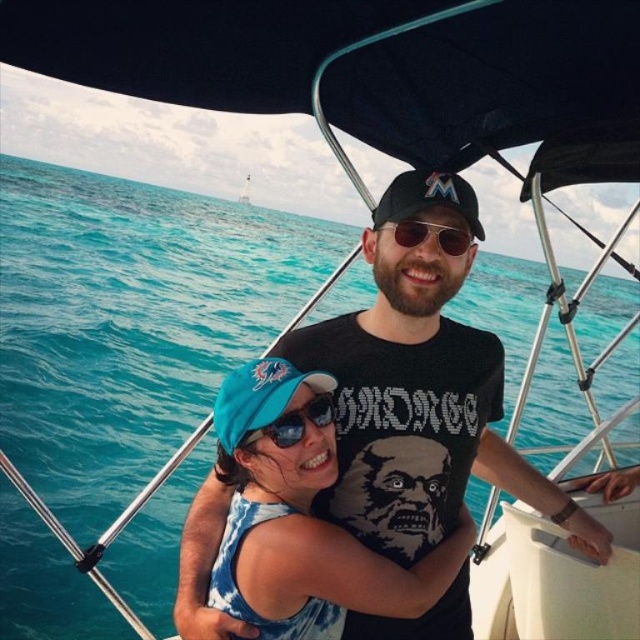
Who is positioned more to the left, blue fabric cap at upper left or sunglasses at center?

blue fabric cap at upper left

Which is in front, point (356, 572) or point (387, 221)?

Positioned in front is point (356, 572).

This screenshot has width=640, height=640. Identify the location of blue fabric cap at upper left. (300, 516).

Based on the photo, is blue fabric cap at upper left above blue reflective sunglasses at center?

Incorrect, blue fabric cap at upper left is not positioned above blue reflective sunglasses at center.

Find the location of `blue fabric cap at upper left`. blue fabric cap at upper left is located at coordinates (300, 516).

Can you confirm if blue reflective sunglasses at center is taller than sunglasses at center?

Correct, blue reflective sunglasses at center is much taller as sunglasses at center.

Is blue reflective sunglasses at center to the left of sunglasses at center from the viewer's perspective?

Correct, you'll find blue reflective sunglasses at center to the left of sunglasses at center.

Does point (304, 428) lie in front of point (416, 237)?

That is True.

The height and width of the screenshot is (640, 640). In order to click on blue reflective sunglasses at center in this screenshot , I will do click(x=296, y=422).